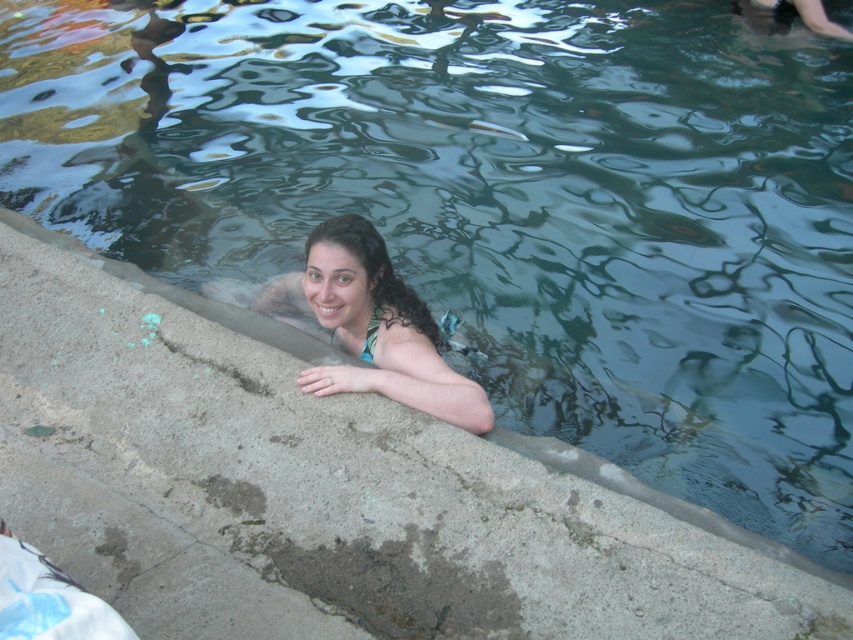
How distant is green matte bikini top at upper center from white matte bikini top at center?

A distance of 0.82 centimeters exists between green matte bikini top at upper center and white matte bikini top at center.

Consider the image. Which is below, green matte bikini top at upper center or white matte bikini top at center?

green matte bikini top at upper center is lower down.

Between point (447, 326) and point (368, 358), which one is positioned behind?

The point (447, 326) is more distant.

Find the location of a particular element. The image size is (853, 640). green matte bikini top at upper center is located at coordinates (370, 336).

Is matte green bikini top at center wider than white matte bikini top at center?

Yes, matte green bikini top at center is wider than white matte bikini top at center.

How far apart are matte green bikini top at center and white matte bikini top at center?

matte green bikini top at center and white matte bikini top at center are 8.70 inches apart from each other.

Locate an element on the screen. Image resolution: width=853 pixels, height=640 pixels. matte green bikini top at center is located at coordinates (379, 324).

Who is taller, matte green bikini top at center or green matte bikini top at upper center?

With more height is matte green bikini top at center.

Based on the photo, who is more distant from viewer, (433, 410) or (378, 312)?

Positioned behind is point (378, 312).

This screenshot has height=640, width=853. What do you see at coordinates (379, 324) in the screenshot? I see `matte green bikini top at center` at bounding box center [379, 324].

Find the location of a particular element. The height and width of the screenshot is (640, 853). matte green bikini top at center is located at coordinates click(379, 324).